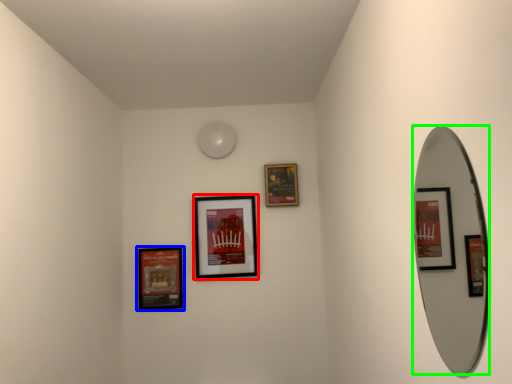
Question: Which is nearer to the picture frame (highlighted by a red box)? picture frame (highlighted by a blue box) or mirror (highlighted by a green box).

Choices:
 (A) picture frame
 (B) mirror

Answer: (A)